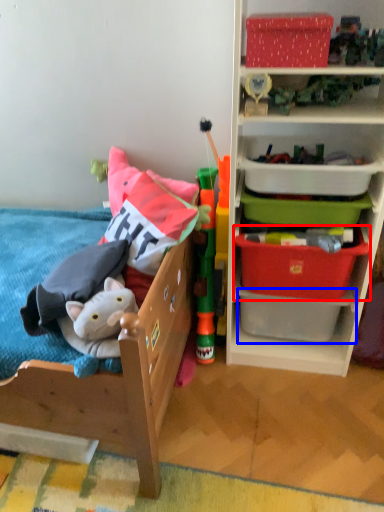
Question: Which point is further to the camera, storage box (highlighted by a red box) or storage box (highlighted by a blue box)?

Choices:
 (A) storage box
 (B) storage box

Answer: (B)